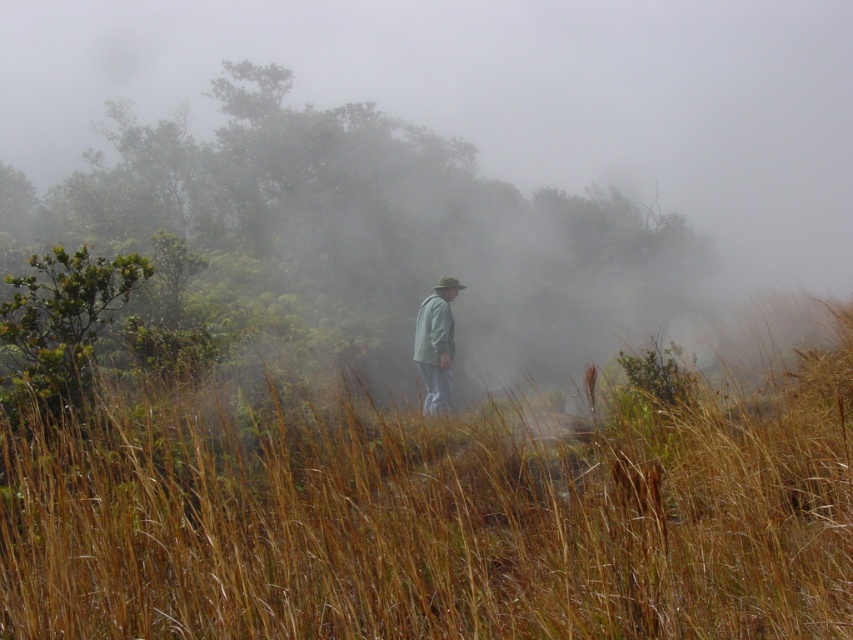
Is brown dry grass at center thinner than foggy mist at center?

Correct, brown dry grass at center's width is less than foggy mist at center's.

Between point (576, 516) and point (740, 294), which one is positioned behind?

The point (740, 294) is more distant.

I want to click on brown dry grass at center, so click(x=436, y=516).

Is green leafy bush at upper left above light gray fabric jacket at center?

Indeed, green leafy bush at upper left is positioned over light gray fabric jacket at center.

Is point (90, 364) positioned behind point (436, 392)?

No, (90, 364) is in front of (436, 392).

Is point (18, 364) less distant than point (416, 324)?

That is True.

Image resolution: width=853 pixels, height=640 pixels. Identify the location of green leafy bush at upper left. (61, 324).

How much distance is there between brown dry grass at center and light gray fabric jacket at center?

A distance of 18.89 feet exists between brown dry grass at center and light gray fabric jacket at center.

Is brown dry grass at center closer to the viewer compared to light gray fabric jacket at center?

Yes, it is in front of light gray fabric jacket at center.

I want to click on brown dry grass at center, so pyautogui.click(x=436, y=516).

The height and width of the screenshot is (640, 853). Identify the location of brown dry grass at center. (436, 516).